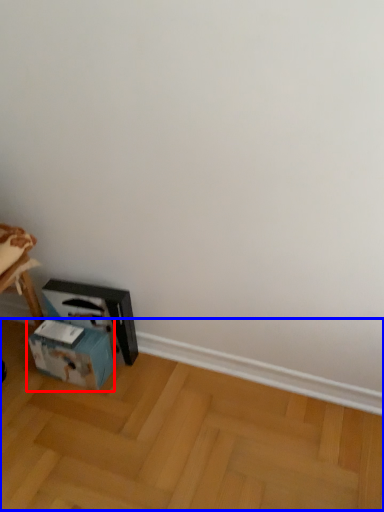
Question: Which object appears closest to the camera in this image, box (highlighted by a red box) or wood (highlighted by a blue box)?

Choices:
 (A) box
 (B) wood

Answer: (B)